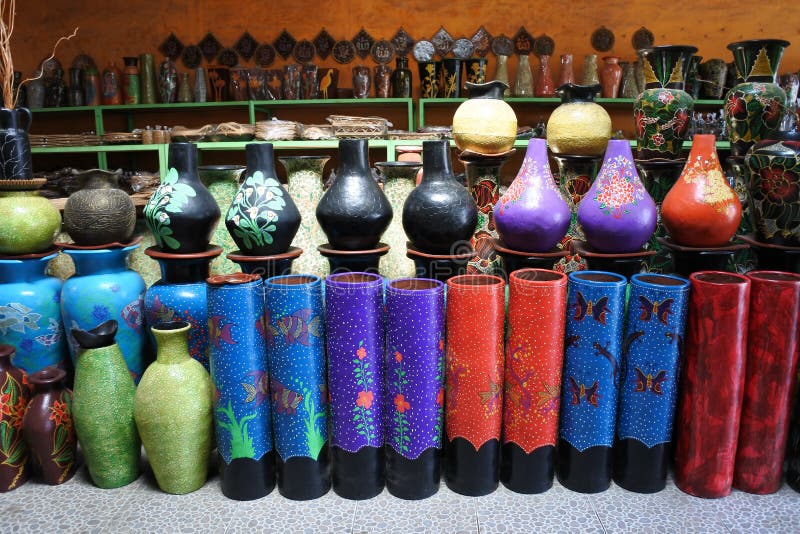
Image resolution: width=800 pixels, height=534 pixels. In order to click on shelve in this screenshot , I will do `click(322, 148)`, `click(322, 103)`.